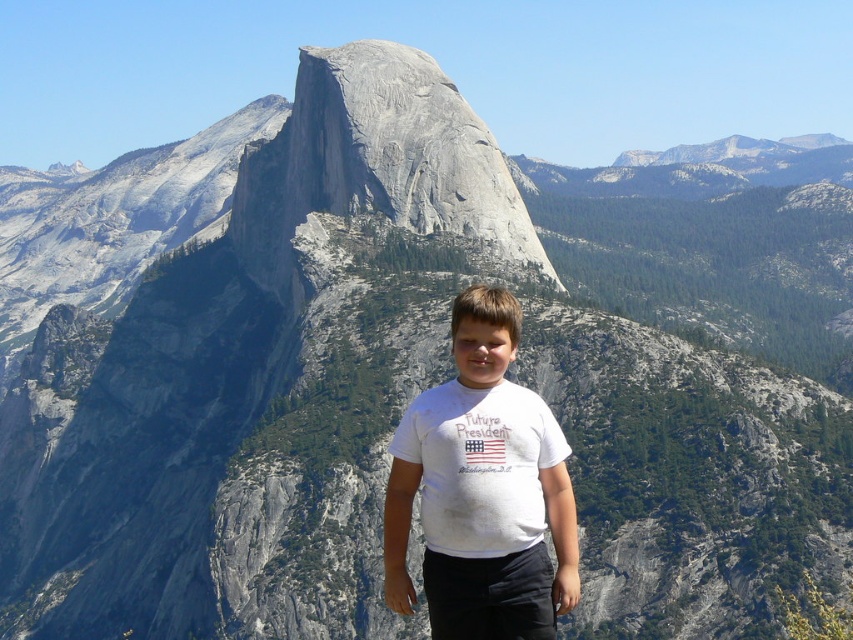
Who is positioned more to the left, white cotton shirt at center or gray rock formation at center?

Positioned to the left is gray rock formation at center.

Find the location of a particular element. Image resolution: width=853 pixels, height=640 pixels. white cotton shirt at center is located at coordinates [x=482, y=490].